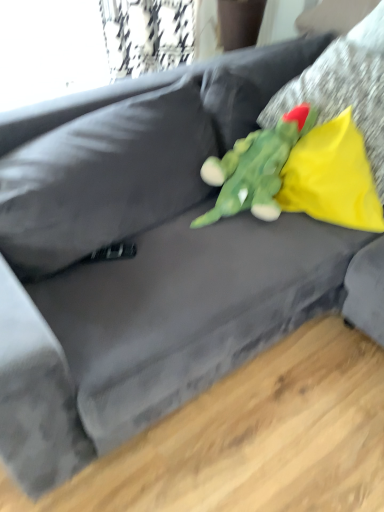
Question: Should I look upward or downward to see yellow fabric pillow at upper right, the 1th pillow in the bottom-to-top sequence?

Choices:
 (A) up
 (B) down

Answer: (A)

Question: Should I look upward or downward to see green plush toy at center?

Choices:
 (A) down
 (B) up

Answer: (B)

Question: Is yellow fabric pillow at upper right, which ranks as the 2th pillow in bottom-to-top order, oriented towards yellow fabric pillow at upper right, the 1th pillow in the bottom-to-top sequence?

Choices:
 (A) yes
 (B) no

Answer: (A)

Question: From a real-world perspective, does yellow fabric pillow at upper right, which ranks as the 2th pillow in bottom-to-top order, stand above yellow fabric pillow at upper right, positioned as the 2th pillow in top-to-bottom order?

Choices:
 (A) yes
 (B) no

Answer: (A)

Question: Is yellow fabric pillow at upper right, which ranks as the 2th pillow in bottom-to-top order, with yellow fabric pillow at upper right, positioned as the 2th pillow in top-to-bottom order?

Choices:
 (A) no
 (B) yes

Answer: (A)

Question: Is yellow fabric pillow at upper right, which ranks as the 2th pillow in bottom-to-top order, shorter than yellow fabric pillow at upper right, positioned as the 2th pillow in top-to-bottom order?

Choices:
 (A) yes
 (B) no

Answer: (B)

Question: Is yellow fabric pillow at upper right, the 1th pillow in the bottom-to-top sequence, at the back of yellow fabric pillow at upper right, which ranks as the 2th pillow in bottom-to-top order?

Choices:
 (A) yes
 (B) no

Answer: (A)

Question: From a real-world perspective, does yellow fabric pillow at upper right, which ranks as the 2th pillow in bottom-to-top order, sit lower than yellow fabric pillow at upper right, positioned as the 2th pillow in top-to-bottom order?

Choices:
 (A) no
 (B) yes

Answer: (A)

Question: Considering the relative sizes of green plush toy at center and yellow fabric pillow at upper right, positioned as the 2th pillow in top-to-bottom order, in the image provided, is green plush toy at center wider than yellow fabric pillow at upper right, positioned as the 2th pillow in top-to-bottom order,?

Choices:
 (A) yes
 (B) no

Answer: (B)

Question: Is the depth of green plush toy at center less than that of yellow fabric pillow at upper right, the 1th pillow in the bottom-to-top sequence?

Choices:
 (A) yes
 (B) no

Answer: (A)

Question: Can yellow fabric pillow at upper right, the 1th pillow in the bottom-to-top sequence, be found inside green plush toy at center?

Choices:
 (A) yes
 (B) no

Answer: (B)

Question: From a real-world perspective, is green plush toy at center physically below yellow fabric pillow at upper right, positioned as the 2th pillow in top-to-bottom order?

Choices:
 (A) yes
 (B) no

Answer: (B)

Question: Is green plush toy at center smaller than yellow fabric pillow at upper right, the 1th pillow in the bottom-to-top sequence?

Choices:
 (A) no
 (B) yes

Answer: (A)

Question: From a real-world perspective, is green plush toy at center on top of yellow fabric pillow at upper right, positioned as the 2th pillow in top-to-bottom order?

Choices:
 (A) no
 (B) yes

Answer: (B)

Question: Does yellow fabric pillow at upper right, positioned as the 2th pillow in top-to-bottom order, have a lesser height compared to yellow fabric pillow at upper right, which ranks as the first pillow in top-to-bottom order?

Choices:
 (A) yes
 (B) no

Answer: (A)